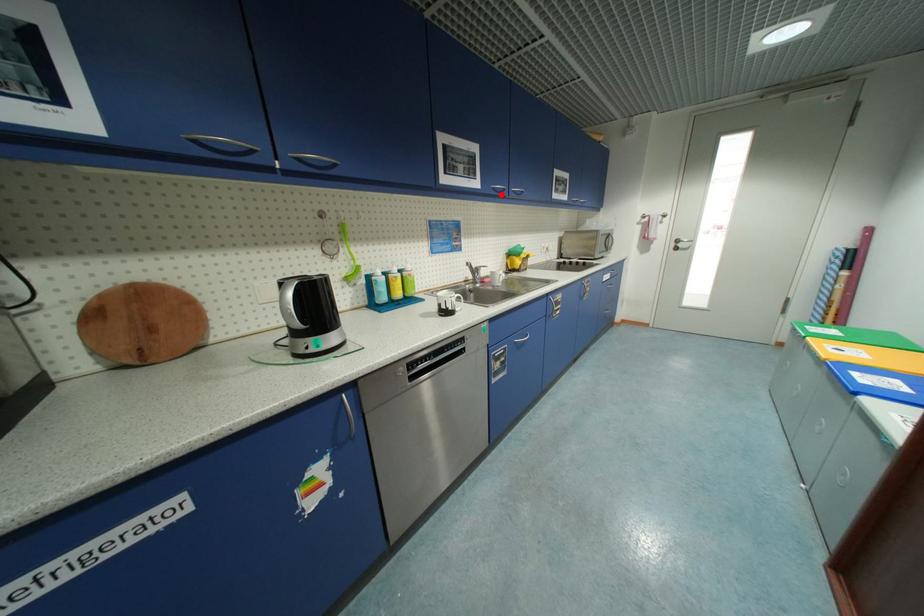
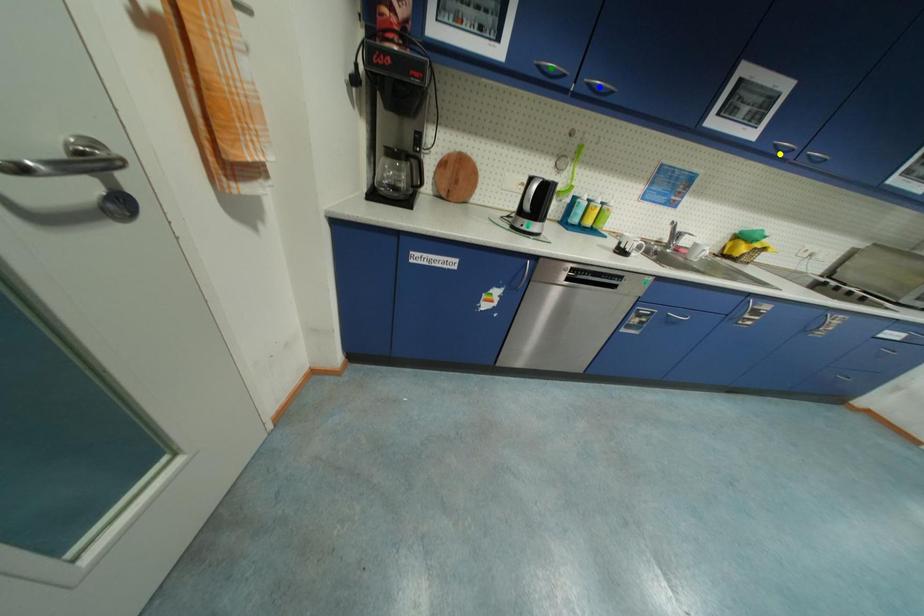
Question: I am providing you with two images of the same scene from different viewpoints. A red point is marked on the first image. You are given multiple points on the second image. In image 2, which mark is for the same physical point as the one in image 1?

Choices:
 (A) green point
 (B) blue point
 (C) yellow point

Answer: (C)